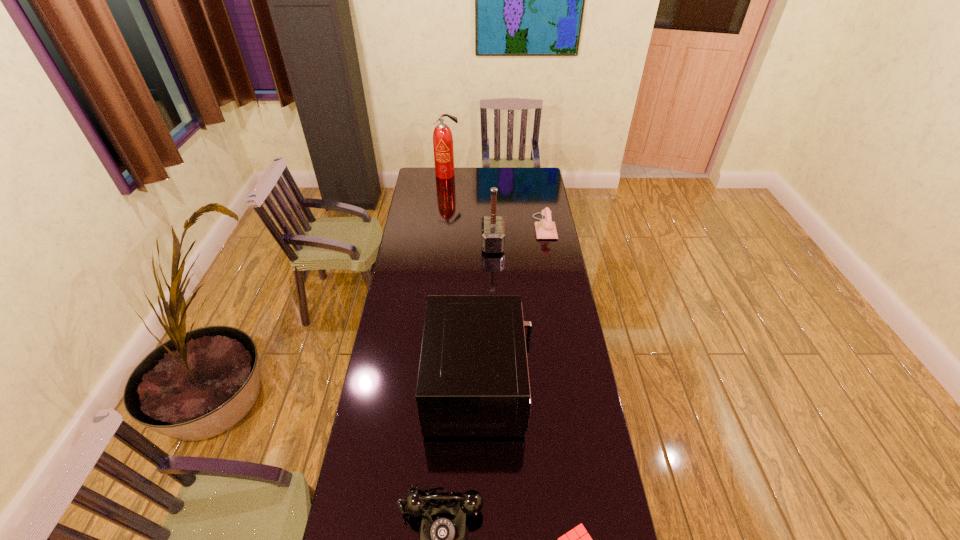
I want to click on free space between the hammer and the farthest object, so click(x=469, y=210).

Identify the location of the closest object relative to the right telephone. The image size is (960, 540). (493, 229).

Image resolution: width=960 pixels, height=540 pixels. What are the coordinates of `object that can be found as the fourth closest to the shortest object` in the screenshot? It's located at (545, 229).